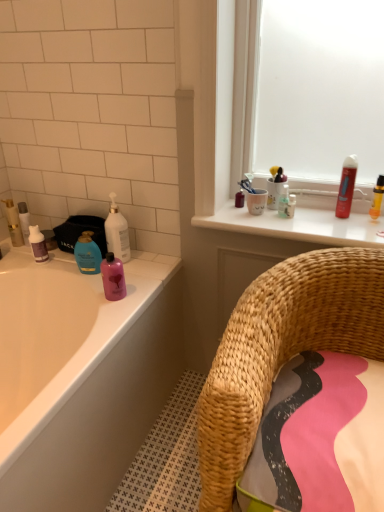
Where is `vacant area that is situated to the right of white glossy bottle at upper left`? The width and height of the screenshot is (384, 512). vacant area that is situated to the right of white glossy bottle at upper left is located at coordinates (151, 261).